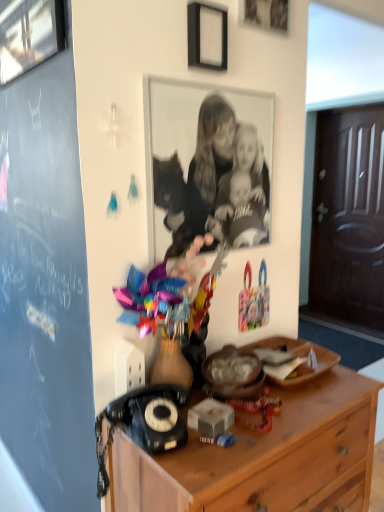
Question: Considering their positions, is wooden plate at center located in front of or behind brushed metal picture frame at upper left, positioned as the 3th picture frame in right-to-left order?

Choices:
 (A) front
 (B) behind

Answer: (B)

Question: Considering the positions of wooden plate at center and brushed metal picture frame at upper left, positioned as the 3th picture frame in right-to-left order, in the image, is wooden plate at center bigger or smaller than brushed metal picture frame at upper left, positioned as the 3th picture frame in right-to-left order,?

Choices:
 (A) big
 (B) small

Answer: (A)

Question: Based on their relative distances, which object is nearer to the wooden picture frame at upper center, which appears as the third picture frame when viewed from the left?

Choices:
 (A) brushed metal picture frame at upper left, which ranks as the 1th picture frame in left-to-right order
 (B) metallic silver toy at center
 (C) black and white photograph of family at center
 (D) wooden plate at center
 (E) wooden chest of drawers at lower right

Answer: (C)

Question: Based on their relative distances, which object is farther from the wooden plate at center?

Choices:
 (A) black matte picture frame at upper center, the 2th picture frame in the left-to-right sequence
 (B) metallic silver toy at center
 (C) black plastic rotary phone at lower left
 (D) black and white photograph of family at center
 (E) wooden picture frame at upper center, acting as the 1th picture frame starting from the right

Answer: (E)